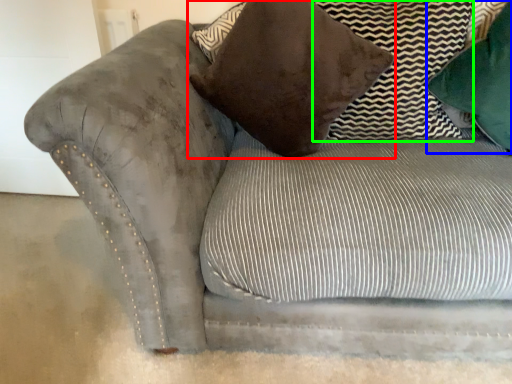
Question: Which is farther away from pillow (highlighted by a red box)? pillow (highlighted by a blue box) or pillow (highlighted by a green box)?

Choices:
 (A) pillow
 (B) pillow

Answer: (A)